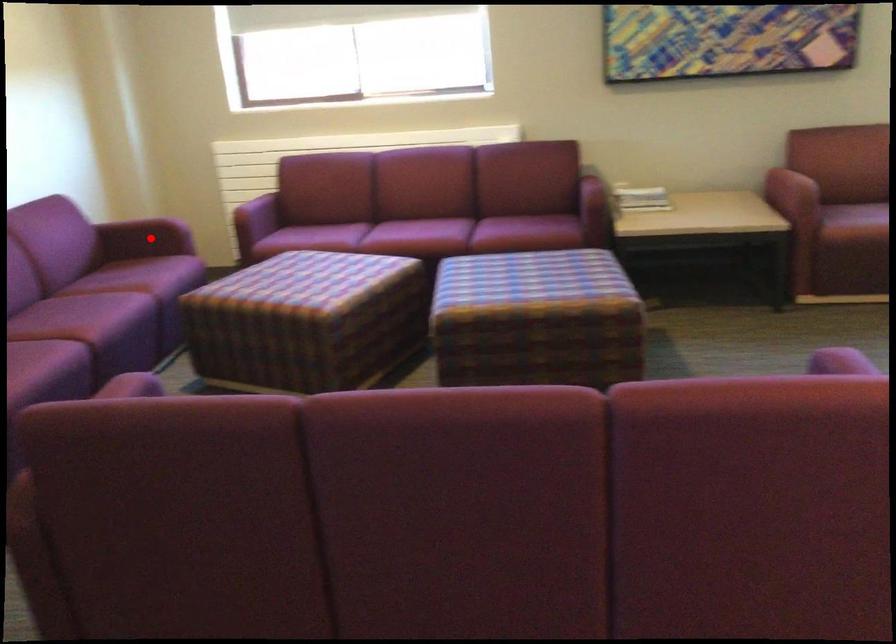
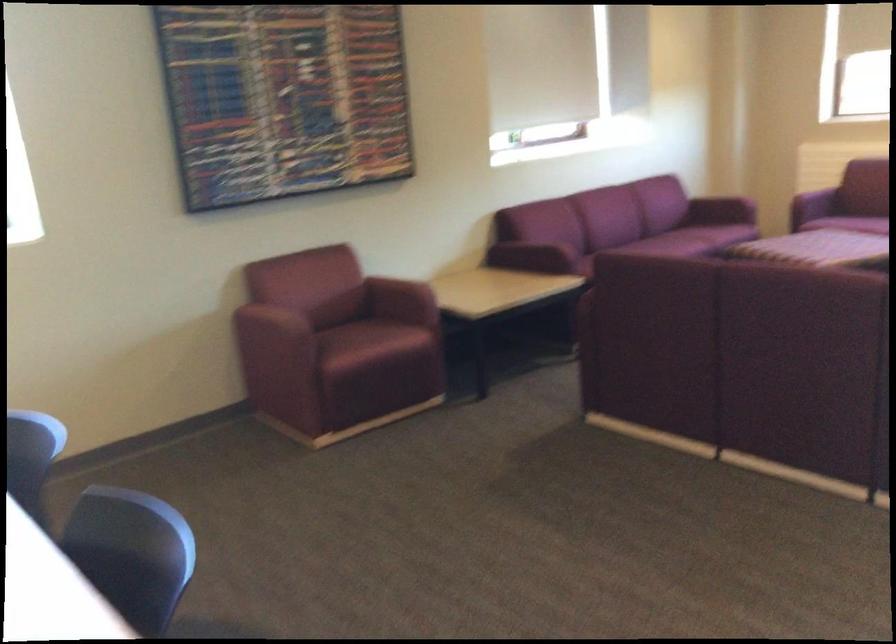
Question: I am providing you with two images of the same scene from different viewpoints. A red point is shown in image1. For the corresponding object point in image2, is it positioned nearer or farther from the camera?

Choices:
 (A) Nearer
 (B) Farther

Answer: (B)